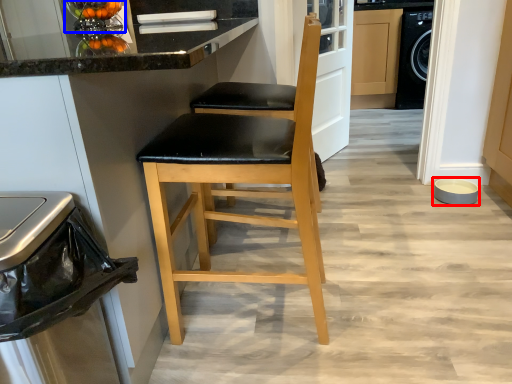
Question: Which point is closer to the camera, appliance (highlighted by a red box) or appliance (highlighted by a blue box)?

Choices:
 (A) appliance
 (B) appliance

Answer: (B)